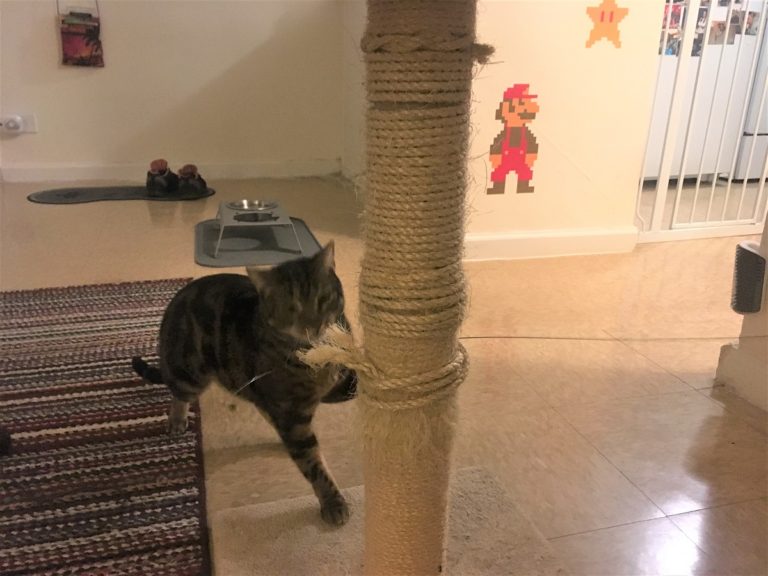
The width and height of the screenshot is (768, 576). In order to click on laminate floor in this screenshot , I will do `click(561, 413)`.